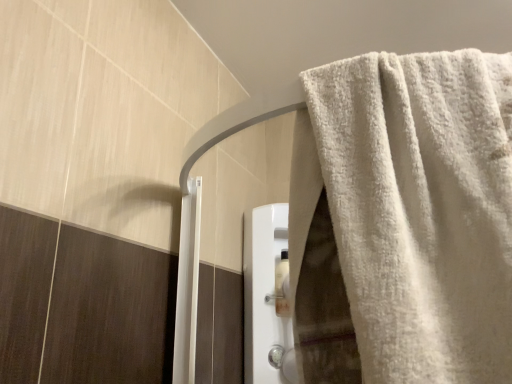
What do you see at coordinates (421, 210) in the screenshot? I see `white fluffy towel at upper right` at bounding box center [421, 210].

Identify the location of white fluffy towel at upper right. This screenshot has width=512, height=384. (421, 210).

Locate an element on the screen. The image size is (512, 384). white fluffy towel at upper right is located at coordinates coord(421,210).